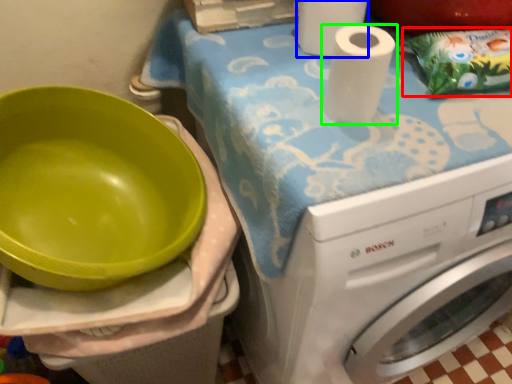
Question: Considering the real-world distances, which object is closest to waste (highlighted by a red box)? paper towel (highlighted by a blue box) or paper towel (highlighted by a green box).

Choices:
 (A) paper towel
 (B) paper towel

Answer: (B)